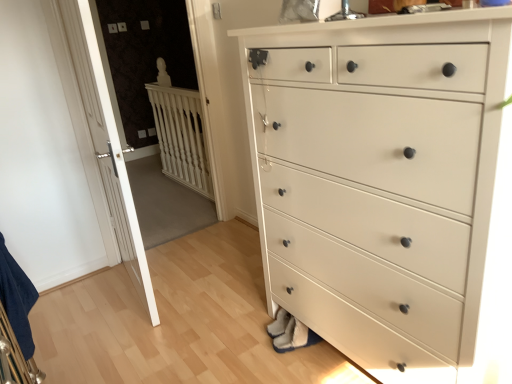
Find the location of a particular element. The width and height of the screenshot is (512, 384). vacant area that is situated to the right of white wooden door at left is located at coordinates (206, 278).